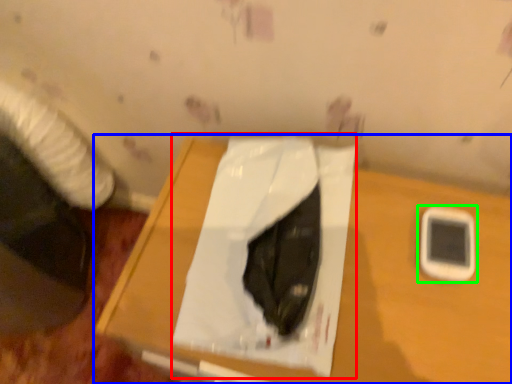
Question: Considering the real-world distances, which object is farthest from sheet (highlighted by a red box)? table (highlighted by a blue box) or mobile phone (highlighted by a green box)?

Choices:
 (A) table
 (B) mobile phone

Answer: (B)